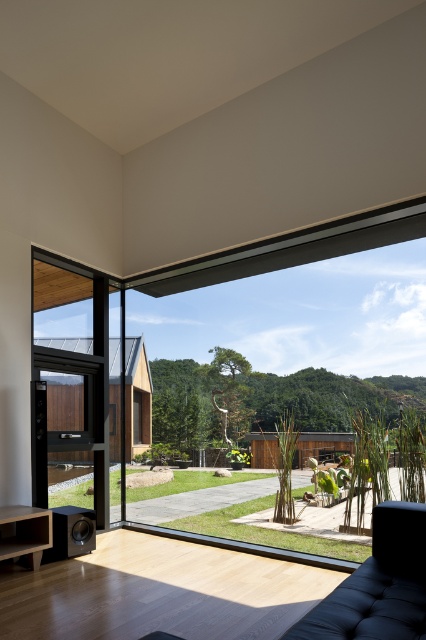
You are a delivery person trying to deliver a large package that is 2 meters tall. You arrive at the entrance and see the transparent glass window at center and the transparent wood glass door at left. Which entrance should you use to get the package inside without tilting it?

The transparent glass window at center is much taller than the transparent wood glass door at left, so you should use the transparent glass window at center to deliver the large package without tilting it.

You are a delivery person holding a package that requires a 3 meters wide space to maneuver. You see the transparent wood glass door at left and the black tufted couch at lower right. Is there enough space between them to move the package through?

The distance between the transparent wood glass door at left and the black tufted couch at lower right is 2.71 meters, which is less than the required 3 meters. Therefore, there isn not enough space to maneuver the package through that area.

You are a delivery person trying to enter the house through the transparent glass window at center. The black tufted couch at lower right is blocking your path. Can you move the couch to access the window?

The transparent glass window at center is positioned on the right side of black tufted couch at lower right, meaning the couch is to the left of the window. Since the window is at the center and the couch is at the lower right, moving the couch to the left might allow access to the window. However, without knowing the exact dimensions or space available, it is uncertain if moving the couch would be feasible.